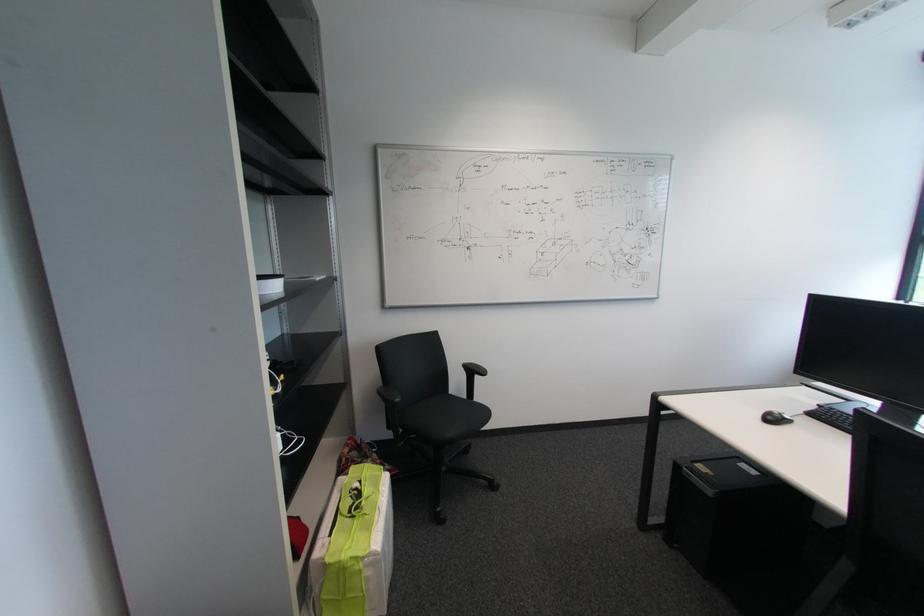
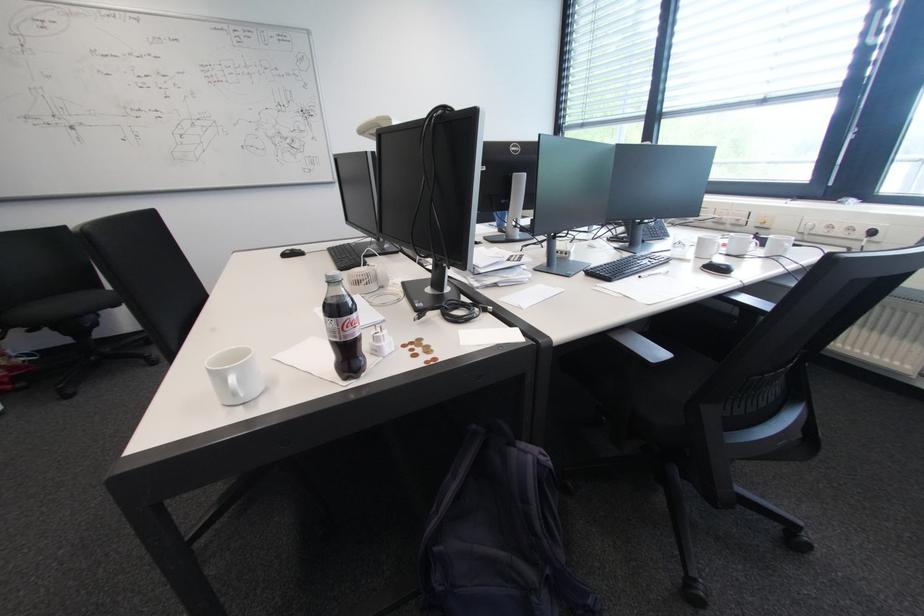
What movement of the cameraman would produce the second image?

The cameraman moved toward right, backward.